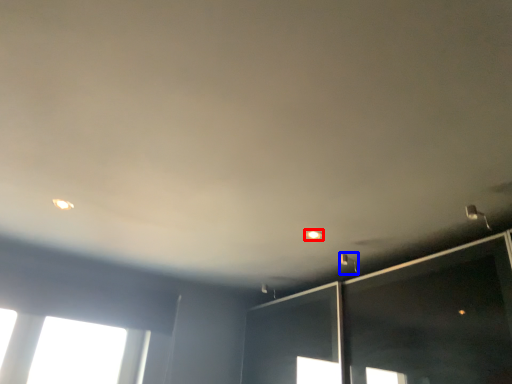
Question: Among these objects, which one is farthest to the camera, dot (highlighted by a red box) or light fixture (highlighted by a blue box)?

Choices:
 (A) dot
 (B) light fixture

Answer: (B)